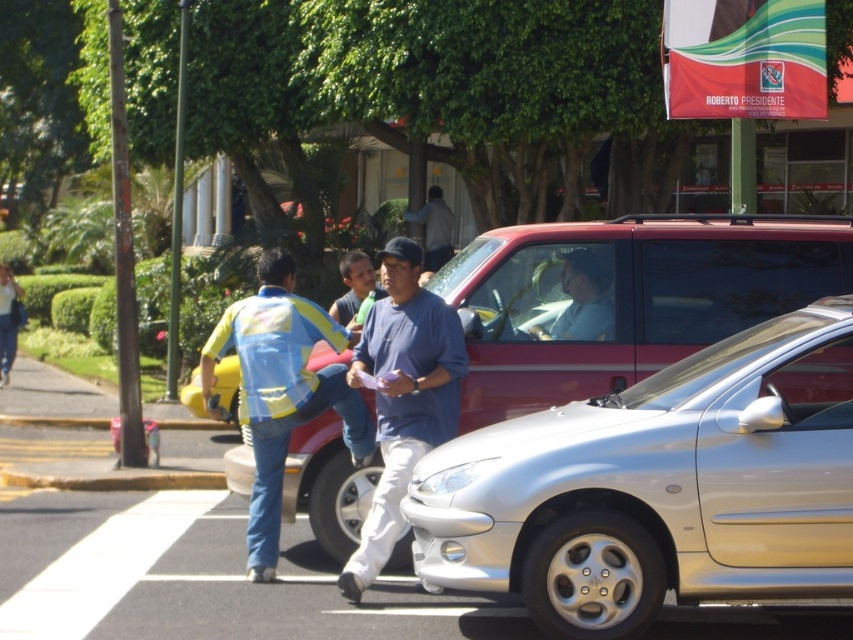
Is point (746, 545) closer to viewer compared to point (447, 420)?

That is True.

Does silver metallic car at center have a greater width compared to blue cotton shirt at center?

Correct, the width of silver metallic car at center exceeds that of blue cotton shirt at center.

Which is in front, point (775, 486) or point (399, 435)?

Point (775, 486) is more forward.

Locate an element on the screen. This screenshot has width=853, height=640. silver metallic car at center is located at coordinates (659, 486).

Which is behind, point (630, 356) or point (451, 212)?

The point (451, 212) is behind.

Does point (711, 252) come closer to viewer compared to point (430, 212)?

Yes, it is.

Does point (465, 275) lie behind point (448, 216)?

No, it is in front of (448, 216).

The image size is (853, 640). Find the location of `metallic silver sedan at center`. metallic silver sedan at center is located at coordinates (627, 298).

Who is taller, yellow reflective safety vest at center or blue denim jeans at center?

blue denim jeans at center

Describe the element at coordinates (273, 349) in the screenshot. The height and width of the screenshot is (640, 853). I see `yellow reflective safety vest at center` at that location.

Who is more forward, (x=341, y=346) or (x=439, y=188)?

Point (x=341, y=346) is in front.

Image resolution: width=853 pixels, height=640 pixels. I want to click on yellow reflective safety vest at center, so 273,349.